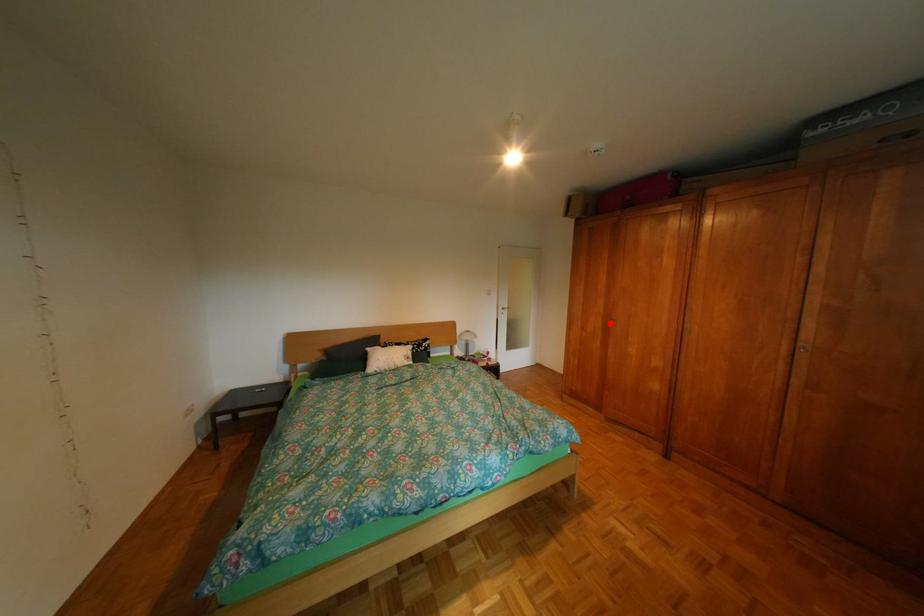
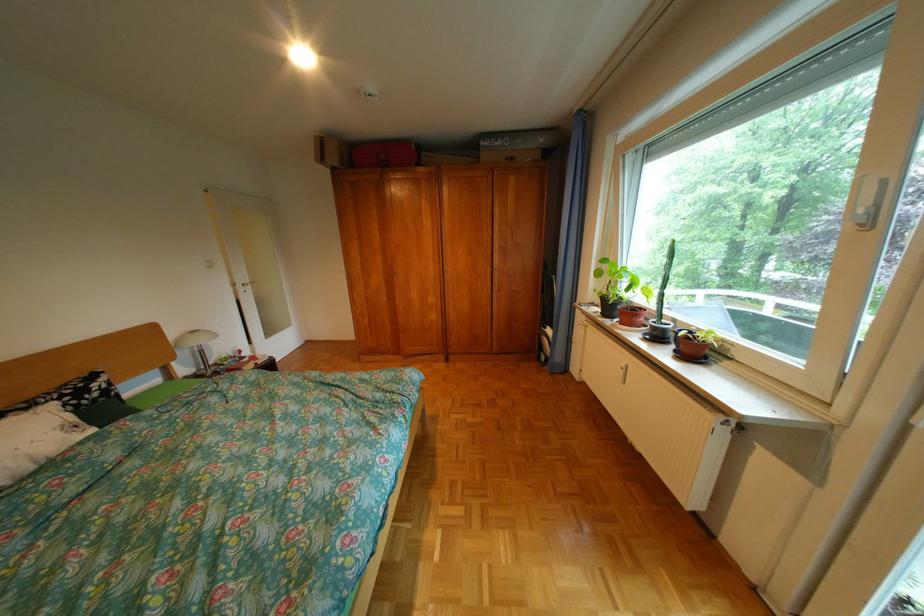
Question: I am providing you with two images of the same scene from different viewpoints. Given a red point in image1, look at the same physical point in image2. Is it:

Choices:
 (A) Closer to the viewpoint
 (B) Farther from the viewpoint

Answer: (A)